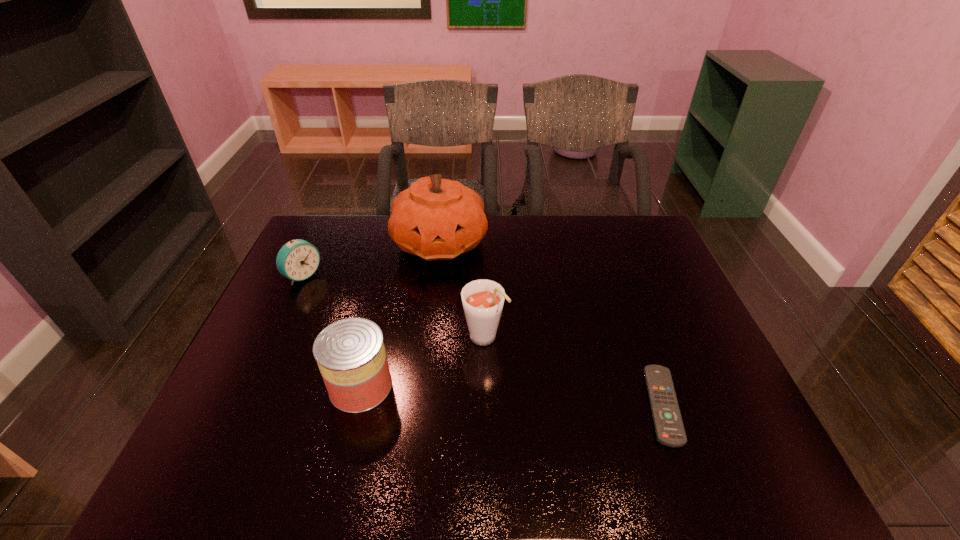
Find the location of a particular element. This screenshot has width=960, height=540. vacant space on the desktop that is between the third tallest object and the remote control and is positioned on the front-facing side of the pumpkin is located at coordinates (531, 396).

You are a GUI agent. You are given a task and a screenshot of the screen. Output one action in this format:
    pyautogui.click(x=<x>, y=<y>)
    Task: Click on the vacant space on the desktop that is between the can and the shortest object and is positioned on the front-facing side of the alarm clock
    
    Given the screenshot: What is the action you would take?
    pyautogui.click(x=469, y=393)

Find the location of a particular element. Image resolution: width=960 pixels, height=540 pixels. free space on the desktop that is between the third tallest object and the rightmost object and is positioned on the drink side of the root beer is located at coordinates (528, 396).